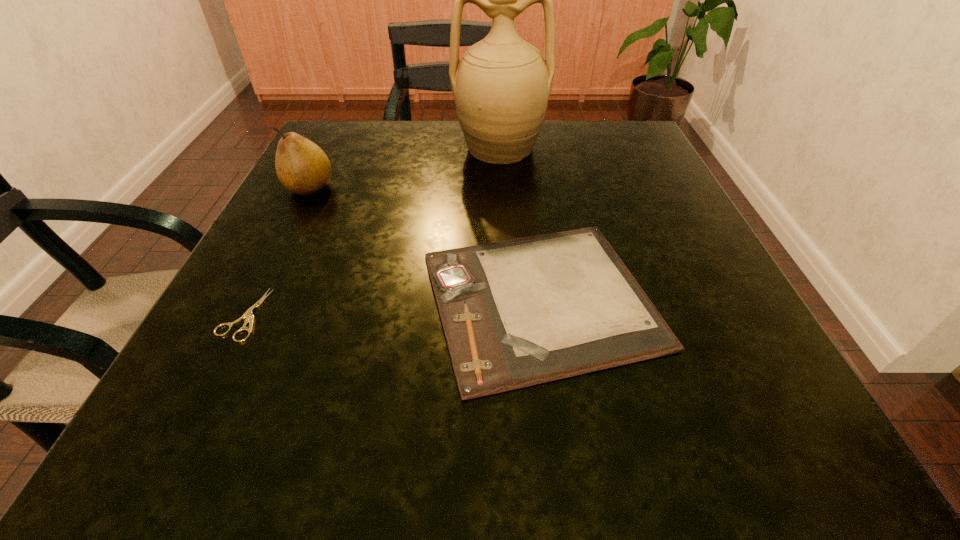
Where is `object at the far edge`? This screenshot has width=960, height=540. object at the far edge is located at coordinates (501, 86).

This screenshot has width=960, height=540. In order to click on object at the near edge in this screenshot , I will do `click(515, 313)`.

Where is `pear that is at the left edge`? Image resolution: width=960 pixels, height=540 pixels. pear that is at the left edge is located at coordinates (302, 167).

What are the coordinates of `shears located at the left edge` in the screenshot? It's located at [x=248, y=314].

Find the location of a particular element. The height and width of the screenshot is (540, 960). object at the right edge is located at coordinates (515, 313).

Find the location of a particular element. This screenshot has height=540, width=960. object that is at the near right corner is located at coordinates (515, 313).

At what (x,y) coordinates should I click in order to perform the action: click on free region at the far edge of the desktop. Please return your answer as a coordinate pair (x, y). The width and height of the screenshot is (960, 540). Looking at the image, I should click on (382, 165).

This screenshot has height=540, width=960. I want to click on free space at the left edge of the desktop, so click(231, 348).

In the image, there is a desktop. Where is `vacant space at the right edge`? The image size is (960, 540). vacant space at the right edge is located at coordinates (661, 271).

In the image, there is a desktop. Find the location of `free region at the far left corner`. free region at the far left corner is located at coordinates (345, 164).